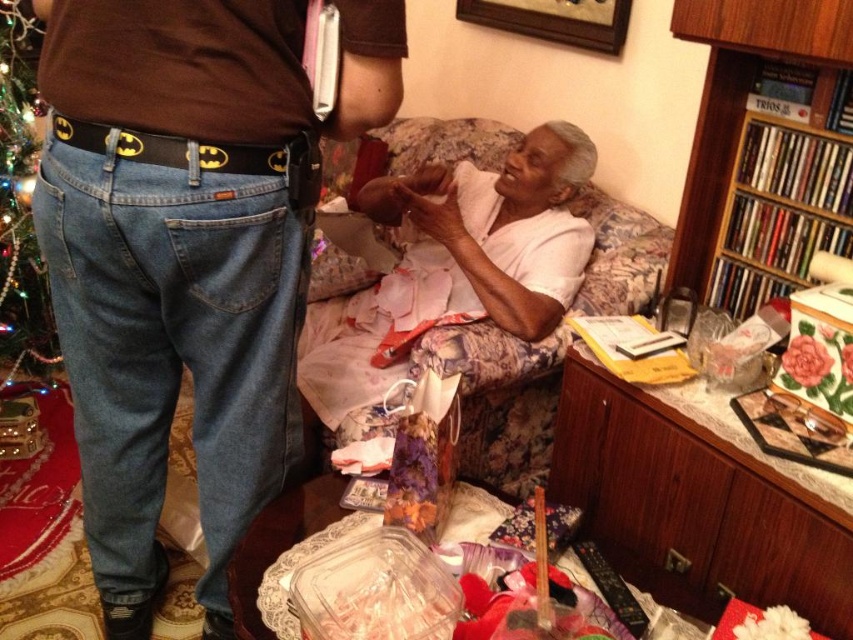
You are standing in the living room and want to place a small gift on the table. The table has two spots marked by points labeled point 1 at point (776, 184) and point 2 at (33, 344). Which point is closer to you so you can place the gift there easily?

Point 1 at point (776, 184) is closer to the camera than point 2 at (33, 344), so you should place the gift there as it is closer to you.

You are planning to place a large rectangular package between the floral fabric couch at center and the wooden bookshelf at right. Based on their widths, will the package fit horizontally between them?

The floral fabric couch at center might be wider than wooden bookshelf at right, so the package may not fit horizontally between them if the combined width of both objects exceeds the space available.